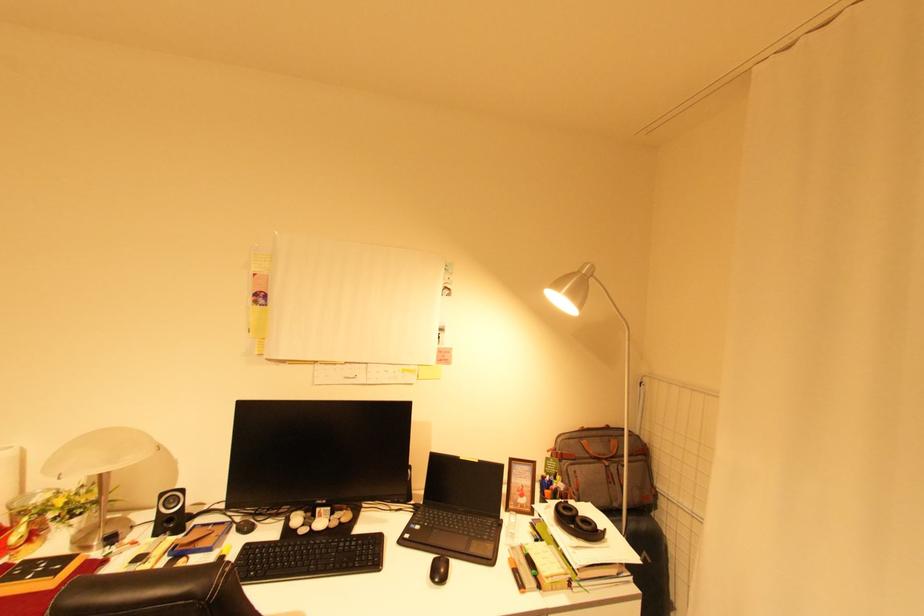
Image resolution: width=924 pixels, height=616 pixels. Describe the element at coordinates (439, 570) in the screenshot. I see `a black computer mouse` at that location.